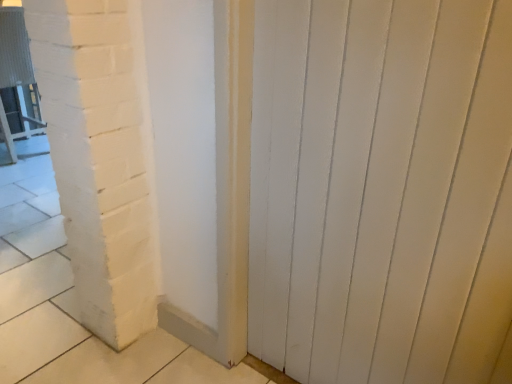
Question: Can you confirm if white painted wood door at center is positioned to the right of metallic silver chair at left?

Choices:
 (A) yes
 (B) no

Answer: (A)

Question: Does white painted wood door at center come behind metallic silver chair at left?

Choices:
 (A) no
 (B) yes

Answer: (A)

Question: Considering the relative positions of white painted wood door at center and metallic silver chair at left in the image provided, is white painted wood door at center to the left of metallic silver chair at left from the viewer's perspective?

Choices:
 (A) no
 (B) yes

Answer: (A)

Question: Is white painted wood door at center thinner than metallic silver chair at left?

Choices:
 (A) yes
 (B) no

Answer: (A)

Question: Considering the relative sizes of white painted wood door at center and metallic silver chair at left in the image provided, is white painted wood door at center taller than metallic silver chair at left?

Choices:
 (A) no
 (B) yes

Answer: (B)

Question: Is white painted wood door at center outside metallic silver chair at left?

Choices:
 (A) yes
 (B) no

Answer: (A)

Question: Is metallic silver chair at left at the left side of white painted wood door at center?

Choices:
 (A) yes
 (B) no

Answer: (A)

Question: Does metallic silver chair at left have a smaller size compared to white painted wood door at center?

Choices:
 (A) no
 (B) yes

Answer: (A)

Question: From a real-world perspective, is metallic silver chair at left on white painted wood door at center?

Choices:
 (A) yes
 (B) no

Answer: (B)

Question: Would you say white painted wood door at center is part of metallic silver chair at left's contents?

Choices:
 (A) no
 (B) yes

Answer: (A)

Question: Is metallic silver chair at left not inside white painted wood door at center?

Choices:
 (A) yes
 (B) no

Answer: (A)

Question: Does metallic silver chair at left have a greater height compared to white painted wood door at center?

Choices:
 (A) yes
 (B) no

Answer: (B)

Question: From the image's perspective, is metallic silver chair at left above or below white painted wood door at center?

Choices:
 (A) above
 (B) below

Answer: (A)